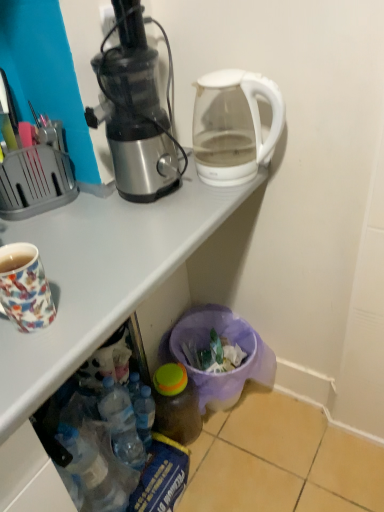
The image size is (384, 512). What do you see at coordinates (144, 415) in the screenshot? I see `translucent plastic bottle at lower center, the second bottle in the right-to-left sequence` at bounding box center [144, 415].

Measure the distance between translucent plastic bottle at lower center, placed as the 1th bottle when sorted from left to right, and camera.

translucent plastic bottle at lower center, placed as the 1th bottle when sorted from left to right, is 1.21 meters from camera.

What is the approximate height of metallic silver juicer at left?

metallic silver juicer at left is 16.35 inches in height.

This screenshot has width=384, height=512. What do you see at coordinates (233, 126) in the screenshot? I see `transparent glass kettle at upper right` at bounding box center [233, 126].

The image size is (384, 512). What do you see at coordinates (25, 287) in the screenshot?
I see `multicolored ceramic mug at left` at bounding box center [25, 287].

Where is `translucent plastic bottle at lower center, the second bottle in the right-to-left sequence`? The image size is (384, 512). translucent plastic bottle at lower center, the second bottle in the right-to-left sequence is located at coordinates (144, 415).

Considering the sizes of white glossy desk at upper center and translucent plastic bottle at lower center, acting as the first bottle starting from the right, in the image, is white glossy desk at upper center wider or thinner than translucent plastic bottle at lower center, acting as the first bottle starting from the right,?

white glossy desk at upper center is wider than translucent plastic bottle at lower center, acting as the first bottle starting from the right.

Can you confirm if white glossy desk at upper center is smaller than translucent plastic bottle at lower center, acting as the first bottle starting from the right?

Incorrect, white glossy desk at upper center is not smaller in size than translucent plastic bottle at lower center, acting as the first bottle starting from the right.

Is point (72, 359) closer to camera compared to point (168, 423)?

That is True.

How many degrees apart are the facing directions of white glossy desk at upper center and translucent plastic bottle at lower center, which ranks as the 2th bottle in left-to-right order?

2.54 degrees separate the facing orientations of white glossy desk at upper center and translucent plastic bottle at lower center, which ranks as the 2th bottle in left-to-right order.

From a real-world perspective, is translucent plastic bottle at lower center, acting as the first bottle starting from the right, located beneath white glossy desk at upper center?

Yes.

Between translucent plastic bottle at lower center, acting as the first bottle starting from the right, and white glossy desk at upper center, which one is positioned behind?

translucent plastic bottle at lower center, acting as the first bottle starting from the right, is more distant.

Can you confirm if translucent plastic bottle at lower center, which ranks as the 2th bottle in left-to-right order, is thinner than white glossy desk at upper center?

Yes.

Which is more to the right, multicolored ceramic mug at left or translucent plastic bottle at lower center, acting as the first bottle starting from the right?

translucent plastic bottle at lower center, acting as the first bottle starting from the right, is more to the right.

Considering the sizes of objects multicolored ceramic mug at left and translucent plastic bottle at lower center, acting as the first bottle starting from the right, in the image provided, who is shorter, multicolored ceramic mug at left or translucent plastic bottle at lower center, acting as the first bottle starting from the right,?

With less height is multicolored ceramic mug at left.

Considering the points (19, 249) and (177, 382), which point is behind, point (19, 249) or point (177, 382)?

The point (177, 382) is farther.

Locate an element on the screen. This screenshot has height=512, width=384. the 2nd bottle positioned below the multicolored ceramic mug at left (from a real-world perspective) is located at coordinates (176, 404).

Who is taller, transparent glass kettle at upper right or white glossy desk at upper center?

Standing taller between the two is white glossy desk at upper center.

How far apart are transparent glass kettle at upper right and white glossy desk at upper center?

They are 8.77 inches apart.

At what (x,y) coordinates should I click in order to perform the action: click on kettle to the right of white glossy desk at upper center. Please return your answer as a coordinate pair (x, y). Looking at the image, I should click on (233, 126).

Does transparent glass kettle at upper right come in front of white glossy desk at upper center?

No, it is not.

Considering the relative positions of multicolored ceramic mug at left and transparent glass kettle at upper right in the image provided, is multicolored ceramic mug at left to the left of transparent glass kettle at upper right from the viewer's perspective?

Yes.

Based on the photo, is transparent glass kettle at upper right completely or partially inside multicolored ceramic mug at left?

No, transparent glass kettle at upper right is located outside of multicolored ceramic mug at left.

Considering the positions of objects multicolored ceramic mug at left and transparent glass kettle at upper right in the image provided, who is behind, multicolored ceramic mug at left or transparent glass kettle at upper right?

transparent glass kettle at upper right is further from the camera.

From a real-world perspective, which object rests below the other?

multicolored ceramic mug at left is physically lower.

Considering the relative sizes of white glossy desk at upper center and translucent plastic bottle at lower center, the second bottle in the right-to-left sequence, in the image provided, is white glossy desk at upper center bigger than translucent plastic bottle at lower center, the second bottle in the right-to-left sequence,?

Yes, white glossy desk at upper center is bigger than translucent plastic bottle at lower center, the second bottle in the right-to-left sequence.

Do you think white glossy desk at upper center is within translucent plastic bottle at lower center, placed as the 1th bottle when sorted from left to right, or outside of it?

white glossy desk at upper center is not enclosed by translucent plastic bottle at lower center, placed as the 1th bottle when sorted from left to right.

Which is more to the right, white glossy desk at upper center or translucent plastic bottle at lower center, placed as the 1th bottle when sorted from left to right?

From the viewer's perspective, translucent plastic bottle at lower center, placed as the 1th bottle when sorted from left to right, appears more on the right side.

Is the surface of white glossy desk at upper center in direct contact with translucent plastic bottle at lower center, placed as the 1th bottle when sorted from left to right?

They are not placed beside each other.

Who is shorter, translucent plastic bottle at lower center, the second bottle in the right-to-left sequence, or metallic silver juicer at left?

translucent plastic bottle at lower center, the second bottle in the right-to-left sequence, is shorter.

In the scene shown: Would you say metallic silver juicer at left is part of translucent plastic bottle at lower center, the second bottle in the right-to-left sequence,'s contents?

No.

In the scene shown: Measure the distance from translucent plastic bottle at lower center, the second bottle in the right-to-left sequence, to metallic silver juicer at left.

30.45 inches.

Consider the image. From the image's perspective, is translucent plastic bottle at lower center, the second bottle in the right-to-left sequence, on metallic silver juicer at left?

No.

Which bottle is the 2nd one when counting from the right side of the white glossy desk at upper center? Please provide its 2D coordinates.

[(176, 404)]

Locate an element on the screen. Image resolution: width=384 pixels, height=512 pixels. desk in front of the translucent plastic bottle at lower center, acting as the first bottle starting from the right is located at coordinates (95, 306).

Looking at the image, which one is located further to white glossy desk at upper center, transparent glass kettle at upper right or translucent plastic bottle at lower center, which ranks as the 2th bottle in left-to-right order?

translucent plastic bottle at lower center, which ranks as the 2th bottle in left-to-right order, is further to white glossy desk at upper center.

When comparing their distances from multicolored ceramic mug at left, does translucent plastic bottle at lower center, which ranks as the 2th bottle in left-to-right order, or translucent plastic bottle at lower center, placed as the 1th bottle when sorted from left to right, seem further?

translucent plastic bottle at lower center, which ranks as the 2th bottle in left-to-right order, is positioned further to the anchor multicolored ceramic mug at left.

Estimate the real-world distances between objects in this image. Which object is closer to multicolored ceramic mug at left, white glossy desk at upper center or translucent plastic bottle at lower center, placed as the 1th bottle when sorted from left to right?

white glossy desk at upper center is closer to multicolored ceramic mug at left.

From the image, which object appears to be farther from multicolored ceramic mug at left, translucent plastic bottle at lower center, placed as the 1th bottle when sorted from left to right, or white glossy desk at upper center?

translucent plastic bottle at lower center, placed as the 1th bottle when sorted from left to right, is further to multicolored ceramic mug at left.

Looking at the image, which one is located further to multicolored ceramic mug at left, transparent glass kettle at upper right or metallic silver juicer at left?

transparent glass kettle at upper right.

Based on their spatial positions, is multicolored ceramic mug at left or transparent glass kettle at upper right further from translucent plastic bottle at lower center, which ranks as the 2th bottle in left-to-right order?

multicolored ceramic mug at left lies further to translucent plastic bottle at lower center, which ranks as the 2th bottle in left-to-right order, than the other object.

Considering their positions, is transparent glass kettle at upper right positioned closer to white glossy desk at upper center than translucent plastic bottle at lower center, placed as the 1th bottle when sorted from left to right?

transparent glass kettle at upper right is closer to white glossy desk at upper center.

Considering their positions, is white glossy desk at upper center positioned closer to metallic silver juicer at left than translucent plastic bottle at lower center, acting as the first bottle starting from the right?

white glossy desk at upper center.

Where is `bottle between transparent glass kettle at upper right and translucent plastic bottle at lower center, which ranks as the 2th bottle in left-to-right order, from top to bottom`? The width and height of the screenshot is (384, 512). bottle between transparent glass kettle at upper right and translucent plastic bottle at lower center, which ranks as the 2th bottle in left-to-right order, from top to bottom is located at coordinates (144, 415).

I want to click on coffee cup between metallic silver juicer at left and white glossy desk at upper center in the vertical direction, so click(25, 287).

What are the coordinates of `kettle between metallic silver juicer at left and translucent plastic bottle at lower center, which ranks as the 2th bottle in left-to-right order, vertically` in the screenshot? It's located at (233, 126).

This screenshot has width=384, height=512. I want to click on kettle between metallic silver juicer at left and white glossy desk at upper center vertically, so click(233, 126).